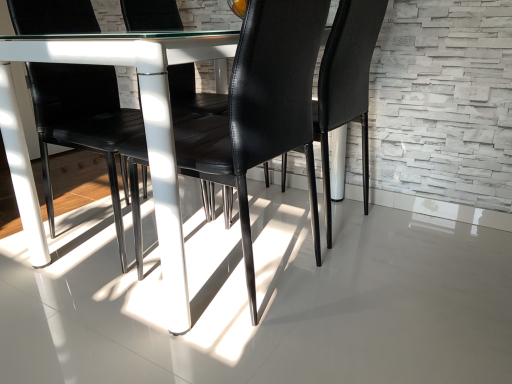
Question: From the image's perspective, is black leather chair at center, marked as the first chair in a front-to-back arrangement, above black leather chair at center, arranged as the second chair when viewed from the front?

Choices:
 (A) yes
 (B) no

Answer: (B)

Question: Is black leather chair at center, arranged as the 2th chair when viewed from the back, in contact with black leather chair at center, arranged as the first chair when viewed from the back?

Choices:
 (A) no
 (B) yes

Answer: (A)

Question: From a real-world perspective, is black leather chair at center, arranged as the 2th chair when viewed from the back, positioned over black leather chair at center, arranged as the first chair when viewed from the back, based on gravity?

Choices:
 (A) no
 (B) yes

Answer: (A)

Question: Would you say black leather chair at center, marked as the first chair in a front-to-back arrangement, is outside black leather chair at center, arranged as the second chair when viewed from the front?

Choices:
 (A) yes
 (B) no

Answer: (A)

Question: Is black leather chair at center, arranged as the 2th chair when viewed from the back, to the left of black leather chair at center, arranged as the second chair when viewed from the front, from the viewer's perspective?

Choices:
 (A) yes
 (B) no

Answer: (A)

Question: Does point (323, 148) appear closer or farther from the camera than point (143, 302)?

Choices:
 (A) farther
 (B) closer

Answer: (A)

Question: In the image, is black leather chair at center, arranged as the first chair when viewed from the back, positioned in front of or behind white glossy concrete at center?

Choices:
 (A) front
 (B) behind

Answer: (B)

Question: From a real-world perspective, relative to white glossy concrete at center, is black leather chair at center, arranged as the second chair when viewed from the front, vertically above or below?

Choices:
 (A) above
 (B) below

Answer: (A)

Question: From the image's perspective, is black leather chair at center, arranged as the first chair when viewed from the back, positioned above or below white glossy concrete at center?

Choices:
 (A) below
 (B) above

Answer: (B)

Question: From a real-world perspective, is black leather chair at center, marked as the first chair in a front-to-back arrangement, above or below white glossy concrete at center?

Choices:
 (A) above
 (B) below

Answer: (A)

Question: From the image's perspective, is black leather chair at center, marked as the first chair in a front-to-back arrangement, positioned above or below white glossy concrete at center?

Choices:
 (A) below
 (B) above

Answer: (B)

Question: Do you think black leather chair at center, marked as the first chair in a front-to-back arrangement, is within white glossy concrete at center, or outside of it?

Choices:
 (A) outside
 (B) inside

Answer: (A)

Question: Considering the positions of black leather chair at center, marked as the first chair in a front-to-back arrangement, and white glossy concrete at center in the image, is black leather chair at center, marked as the first chair in a front-to-back arrangement, wider or thinner than white glossy concrete at center?

Choices:
 (A) wide
 (B) thin

Answer: (B)

Question: In the image, is white glossy concrete at center positioned in front of or behind black leather chair at center, marked as the first chair in a front-to-back arrangement?

Choices:
 (A) behind
 (B) front

Answer: (B)

Question: Looking at the image, does white glossy concrete at center seem bigger or smaller compared to black leather chair at center, marked as the first chair in a front-to-back arrangement?

Choices:
 (A) small
 (B) big

Answer: (A)